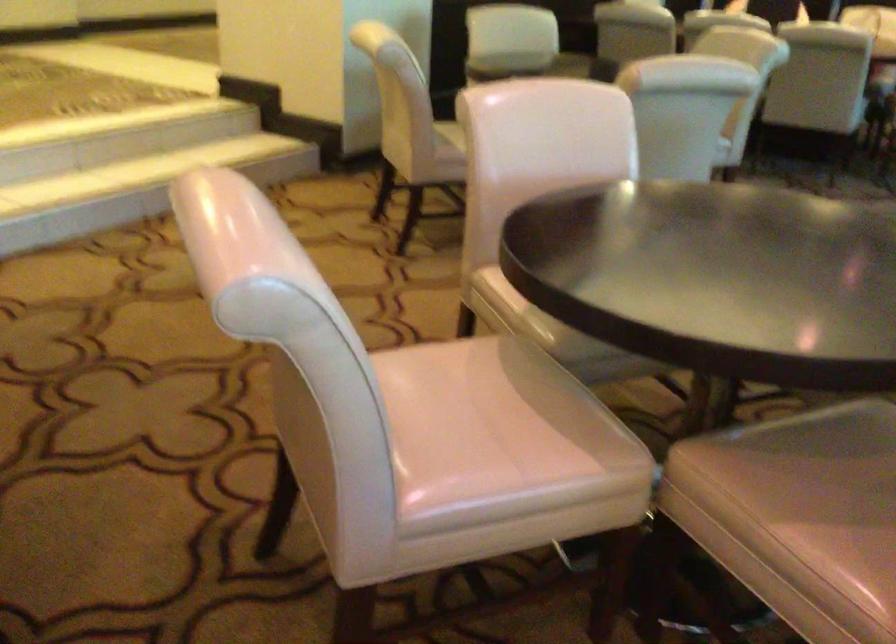
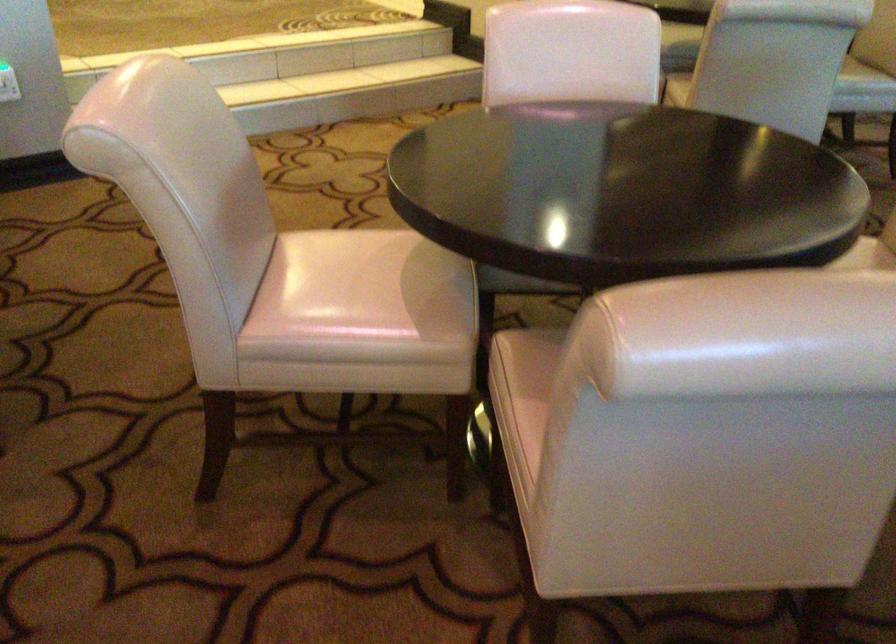
Where in the second image is the point corresponding to (454,410) from the first image?

(347, 278)